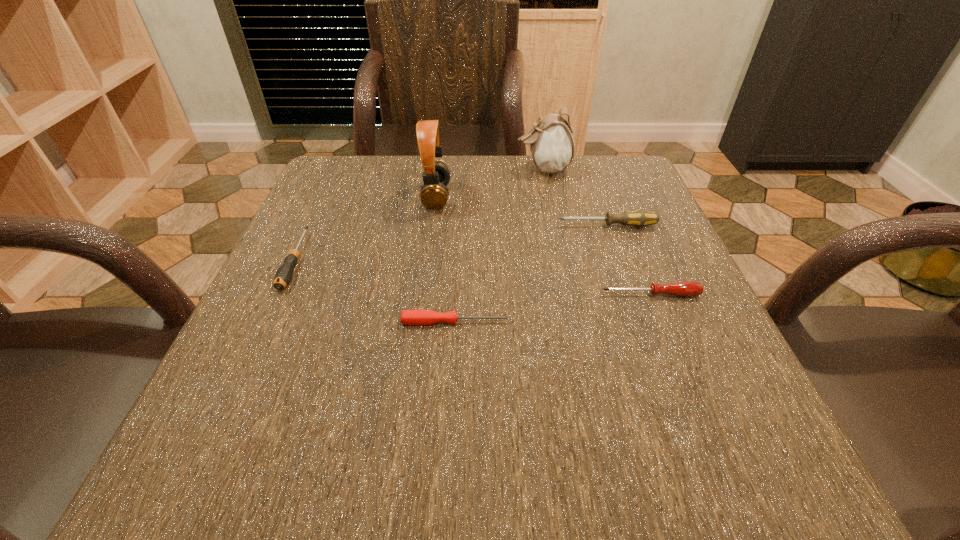
This screenshot has height=540, width=960. I want to click on free space between the pouch and the second screwdriver from left to right, so point(499,245).

This screenshot has height=540, width=960. I want to click on free space between the farthest screwdriver and the leftmost object, so click(x=451, y=243).

I want to click on vacant point located between the leftmost object and the fifth nearest object, so click(x=367, y=228).

You are a GUI agent. You are given a task and a screenshot of the screen. Output one action in this format:
    pyautogui.click(x=<x>, y=<y>)
    Task: Click on the empty space between the tallest screwdriver and the nearest object
    Image resolution: width=960 pixels, height=540 pixels.
    Given the screenshot: What is the action you would take?
    pyautogui.click(x=531, y=274)

Where is `free space between the farthest screwdriver and the headset`? The height and width of the screenshot is (540, 960). free space between the farthest screwdriver and the headset is located at coordinates pos(521,211).

Select which object appears as the third closest to the fourth nearest object. Please provide its 2D coordinates. Your answer should be formatted as a tuple, i.e. [(x, y)], where the tuple contains the x and y coordinates of a point satisfying the conditions above.

[(434, 194)]

Where is `object identified as the fifth closest to the third screwdriver from right to left`? The image size is (960, 540). object identified as the fifth closest to the third screwdriver from right to left is located at coordinates (552, 146).

Identify which screwdriver is the third nearest to the third farthest object. Please provide its 2D coordinates. Your answer should be formatted as a tuple, i.e. [(x, y)], where the tuple contains the x and y coordinates of a point satisfying the conditions above.

[(283, 276)]

Where is `screwdriver that is the closest to the nearest object`? The height and width of the screenshot is (540, 960). screwdriver that is the closest to the nearest object is located at coordinates (686, 289).

This screenshot has width=960, height=540. Identify the location of free point that satisfies the following two spatial constraints: 1. on the front-facing side of the farthest object; 2. on the front side of the leftmost screwdriver. (563, 260).